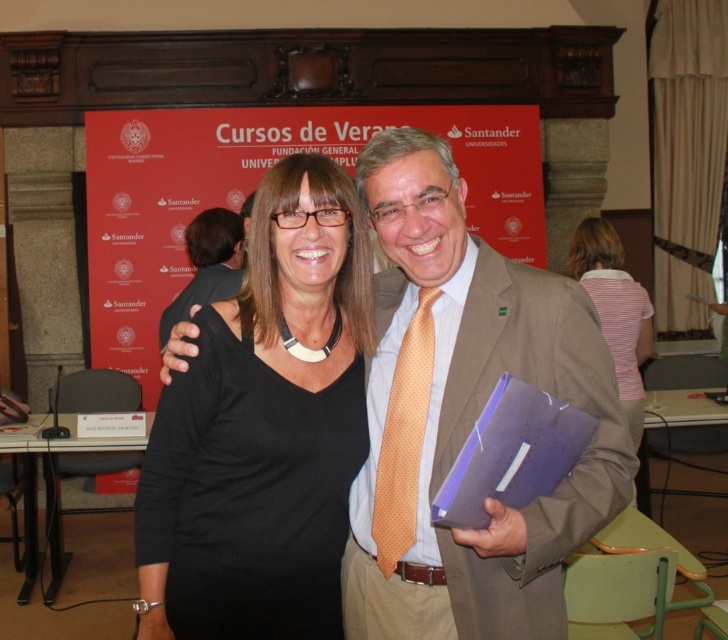
Question: Does matte brown suit at center come in front of striped fabric shirt at center?

Choices:
 (A) yes
 (B) no

Answer: (A)

Question: Considering the real-world distances, which object is closest to the striped fabric shirt at center?

Choices:
 (A) black matte shirt at center
 (B) matte brown suit at center

Answer: (B)

Question: Is matte brown suit at center behind striped fabric shirt at center?

Choices:
 (A) yes
 (B) no

Answer: (B)

Question: Which point is farther from the camera taking this photo?

Choices:
 (A) (649, 355)
 (B) (593, 371)

Answer: (A)

Question: From the image, what is the correct spatial relationship of matte brown suit at center in relation to striped fabric shirt at center?

Choices:
 (A) right
 (B) left

Answer: (B)

Question: Based on their relative distances, which object is nearer to the black matte shirt at center?

Choices:
 (A) matte brown suit at center
 (B) striped fabric shirt at center

Answer: (A)